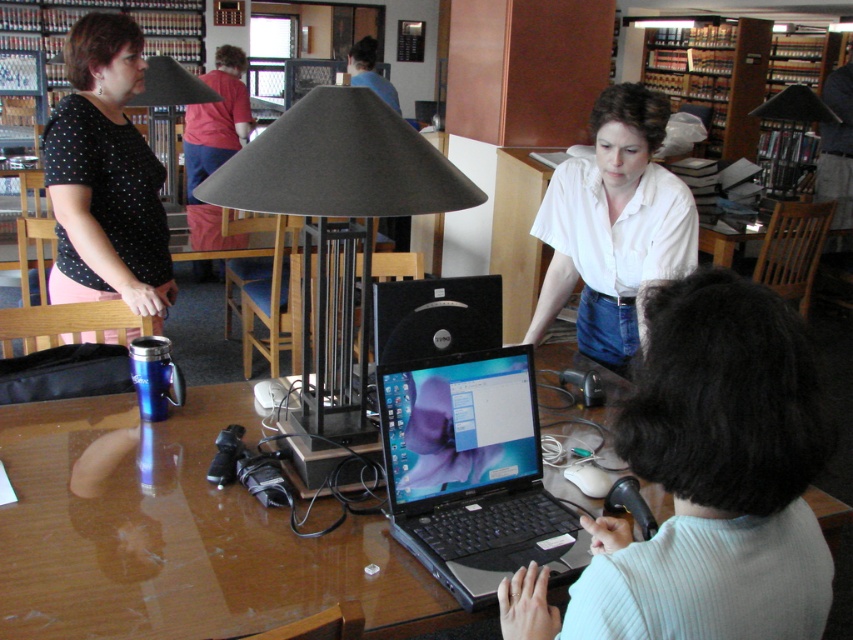
You are organizing items on the table and need to place the black matte lamp at center next to the wooden bookshelf at upper right. Can the lamp fit horizontally next to the bookshelf without overlapping?

The black matte lamp at center has a width less than the wooden bookshelf at upper right, so it can fit horizontally next to the bookshelf without overlapping.

You are a visitor in the library and want to know which object is taller between the black matte lamp at center and the wooden bookshelf at upper right. Can you tell me?

The wooden bookshelf at upper right is taller than the black matte lamp at center.